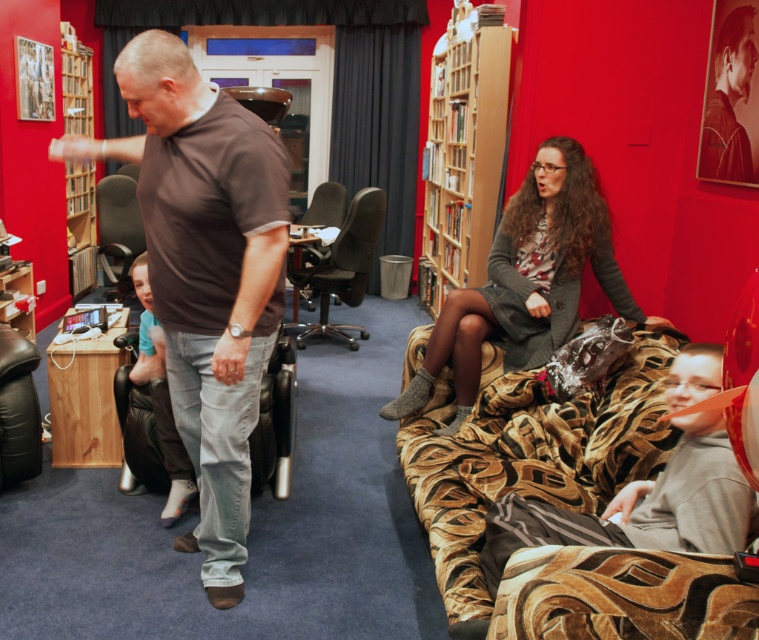
Can you confirm if wooden bookshelf at upper center is positioned to the left of black leather armchair at center?

In fact, wooden bookshelf at upper center is to the right of black leather armchair at center.

Does wooden bookshelf at upper center have a larger size compared to black leather armchair at center?

Yes, wooden bookshelf at upper center is bigger than black leather armchair at center.

This screenshot has height=640, width=759. Identify the location of wooden bookshelf at upper center. (463, 156).

Does brown cotton shirt at left appear on the left side of smooth brown leather jacket at upper center?

Indeed, brown cotton shirt at left is positioned on the left side of smooth brown leather jacket at upper center.

Does brown cotton shirt at left appear on the right side of smooth brown leather jacket at upper center?

In fact, brown cotton shirt at left is to the left of smooth brown leather jacket at upper center.

The width and height of the screenshot is (759, 640). What do you see at coordinates (206, 273) in the screenshot?
I see `brown cotton shirt at left` at bounding box center [206, 273].

Identify the location of brown cotton shirt at left. Image resolution: width=759 pixels, height=640 pixels. (206, 273).

Does dark gray fabric office chair at center have a smaller size compared to wooden bookshelf at left?

Incorrect, dark gray fabric office chair at center is not smaller in size than wooden bookshelf at left.

Does dark gray fabric office chair at center lie behind wooden bookshelf at left?

No, dark gray fabric office chair at center is closer to the viewer.

Is point (351, 304) positioned before point (71, 120)?

Yes, it is.

Find the location of a particular element. This screenshot has height=640, width=759. dark gray fabric office chair at center is located at coordinates (342, 268).